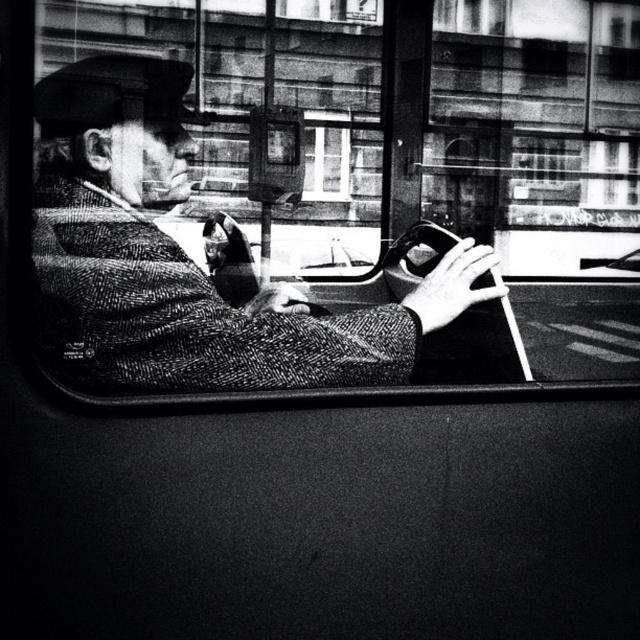
Question: Is herringbone wool coat at center thinner than transparent glass window at center?

Choices:
 (A) yes
 (B) no

Answer: (B)

Question: Among these objects, which one is nearest to the camera?

Choices:
 (A) herringbone wool coat at center
 (B) transparent glass window at center

Answer: (A)

Question: Among these objects, which one is nearest to the camera?

Choices:
 (A) transparent glass window at center
 (B) herringbone wool coat at center

Answer: (B)

Question: Is herringbone wool coat at center smaller than transparent glass window at center?

Choices:
 (A) yes
 (B) no

Answer: (B)

Question: From the image, what is the correct spatial relationship of herringbone wool coat at center in relation to transparent glass window at center?

Choices:
 (A) right
 (B) left

Answer: (B)